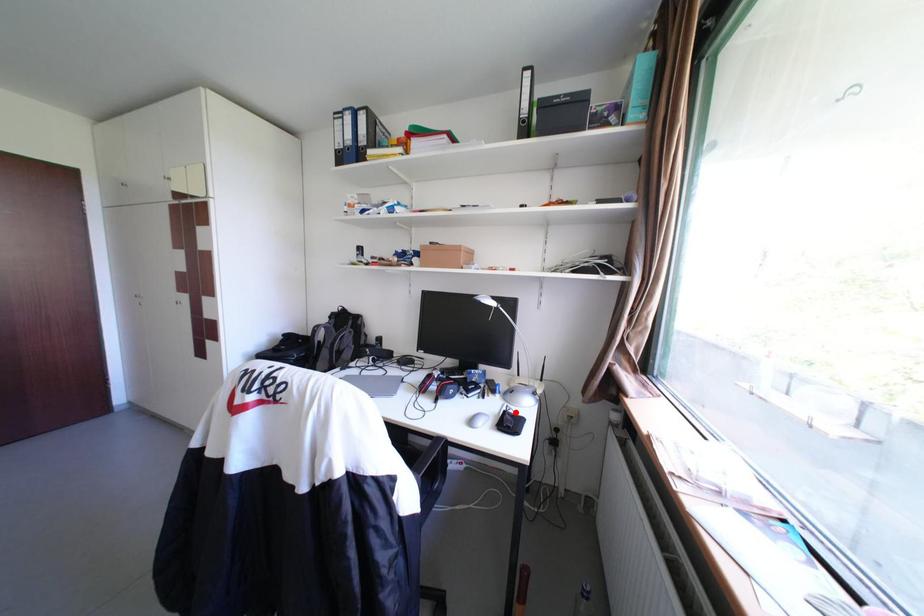
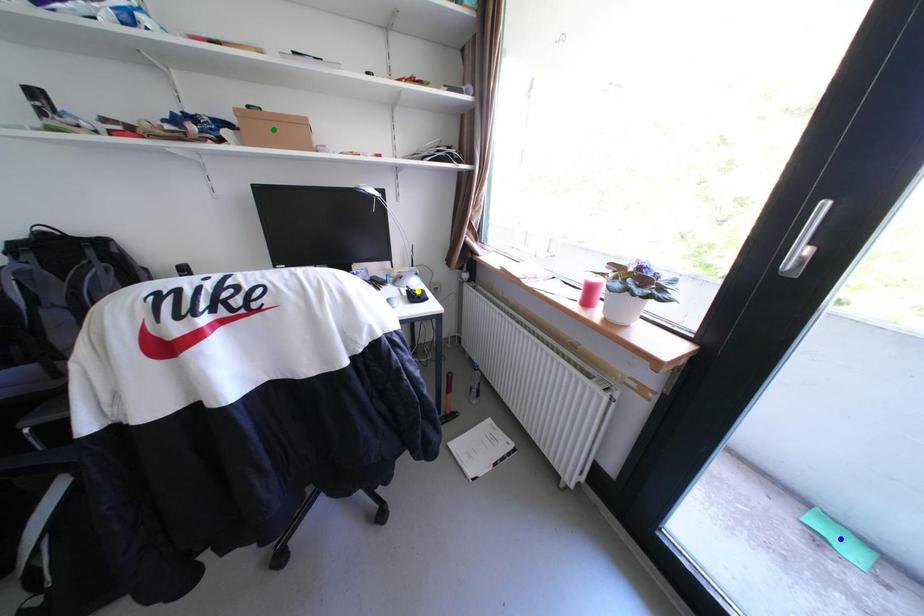
Question: I am providing you with two images of the same scene from different viewpoints. A red point is marked on the first image. You are given multiple points on the second image. Which point in image 2 is actually the same real-world point as the red point in image 1?

Choices:
 (A) green point
 (B) blue point
 (C) yellow point

Answer: (C)